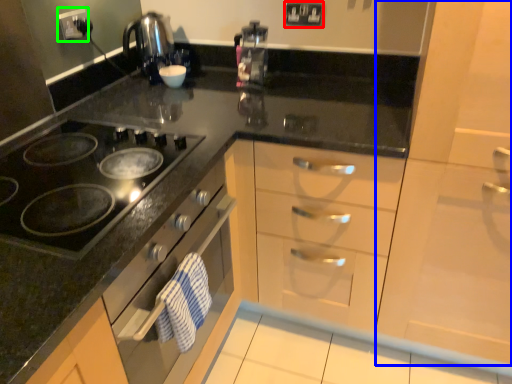
Question: Which is farther away from electric outlet (highlighted by a red box)? cabinetry (highlighted by a blue box) or electric outlet (highlighted by a green box)?

Choices:
 (A) cabinetry
 (B) electric outlet

Answer: (A)